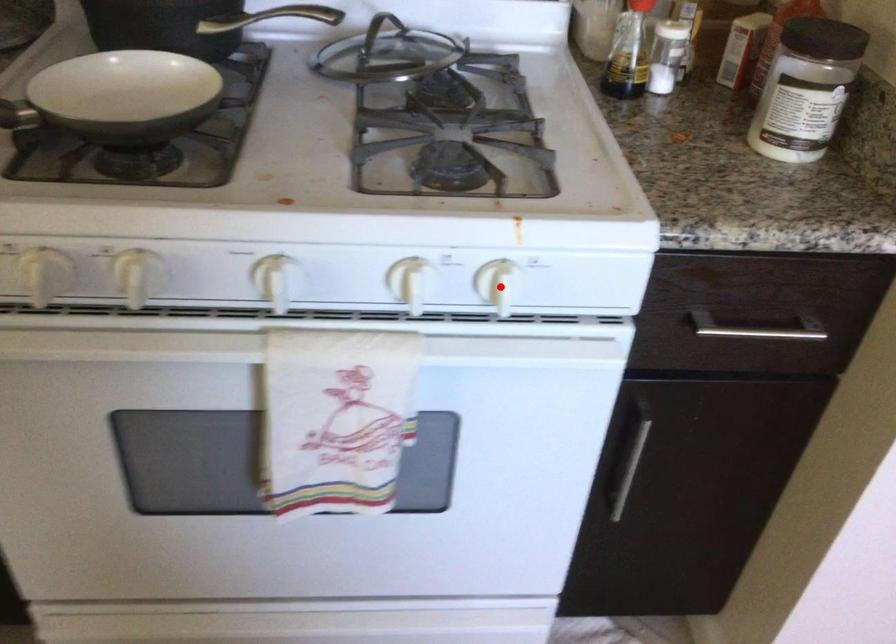
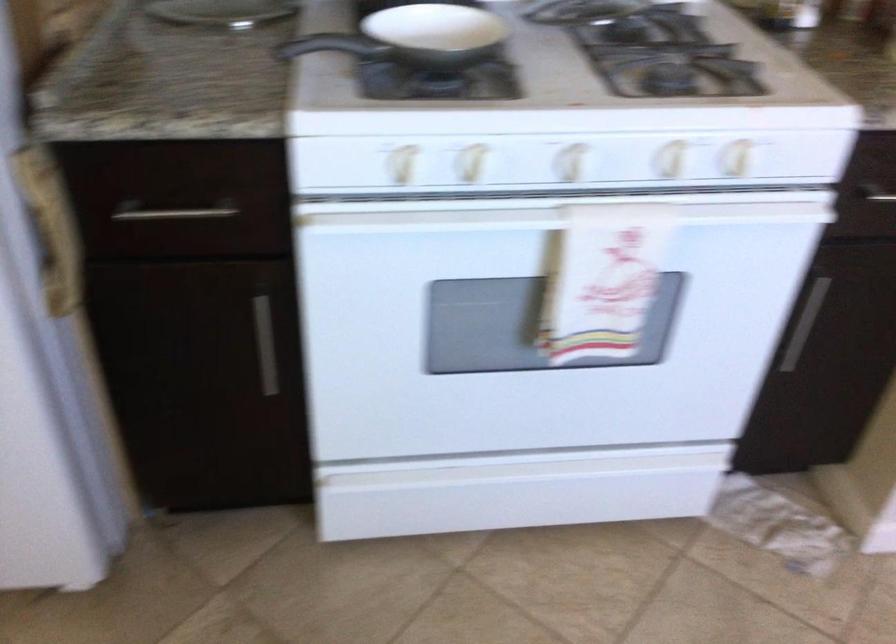
Question: I am providing you with two images of the same scene from different viewpoints. Given a red point in image1, look at the same physical point in image2. Is it:

Choices:
 (A) Closer to the viewpoint
 (B) Farther from the viewpoint

Answer: (B)